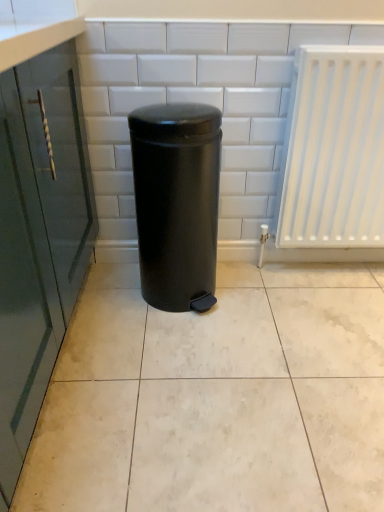
This screenshot has width=384, height=512. I want to click on free location to the right of black matte waste container at center, so click(x=261, y=301).